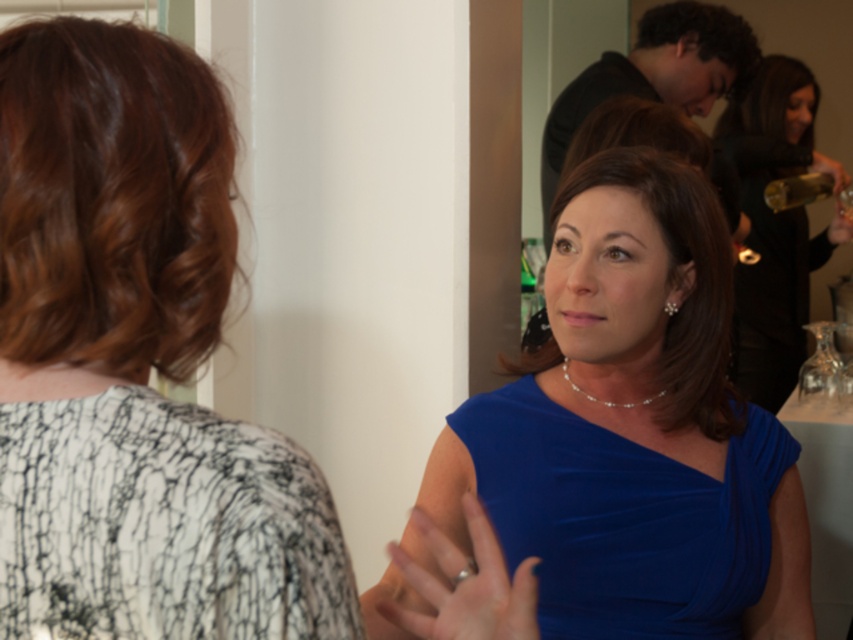
You are a photographer at a party and want to take a photo of the two women in the foreground. You notice the white lace blouse at upper left and the white textured dress at upper left in the background. To ensure both are visible, which clothing item should you adjust the focus on to avoid blurring?

The white lace blouse at upper left is taller than the white textured dress at upper left, so adjusting focus on the white lace blouse at upper left would ensure both are in focus since it is closer to the camera.

You are at a party and want to compliment someone on their accessories. You see the white lace blouse at upper left and the pearl earrings at center. Which one is positioned more to the left?

The white lace blouse at upper left is positioned more to the left than the pearl earrings at center.